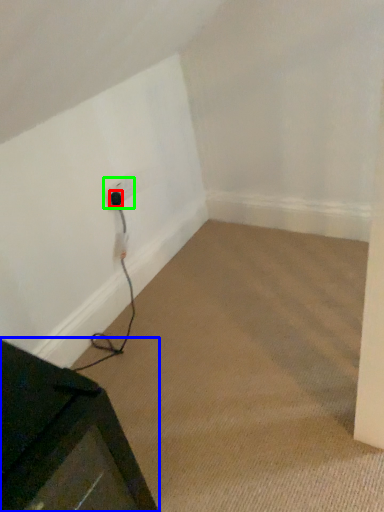
Question: Which object is the farthest from plug (highlighted by a red box)? Choose among these: furniture (highlighted by a blue box) or electric outlet (highlighted by a green box).

Choices:
 (A) furniture
 (B) electric outlet

Answer: (A)